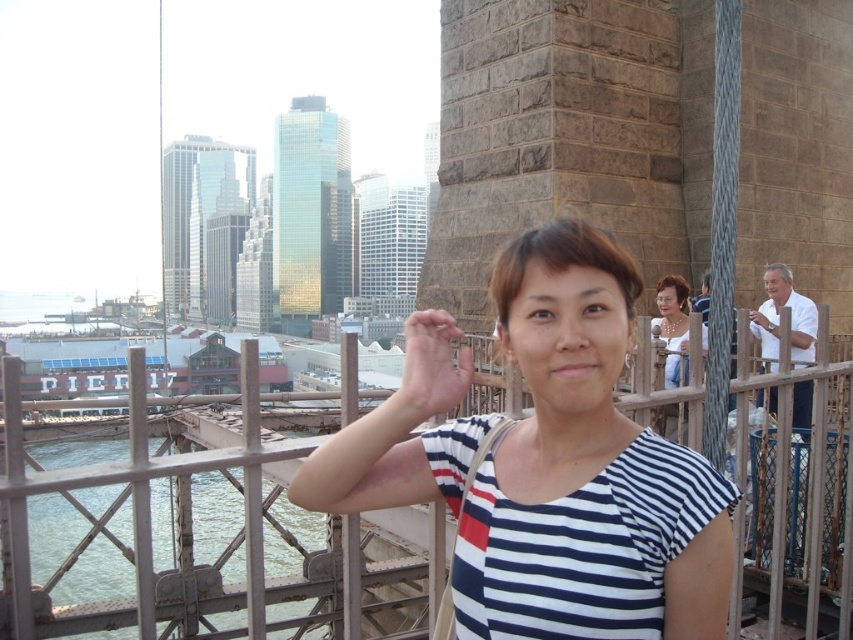
Question: Does white striped shirt at center come behind matte gold necklace at upper right?

Choices:
 (A) yes
 (B) no

Answer: (B)

Question: Does metal fence at center appear under white cotton shirt at right?

Choices:
 (A) no
 (B) yes

Answer: (B)

Question: Which point is closer to the camera taking this photo?

Choices:
 (A) (683, 330)
 (B) (426, 390)

Answer: (B)

Question: Can you confirm if white striped shirt at center is smaller than matte skin hand at center?

Choices:
 (A) no
 (B) yes

Answer: (A)

Question: Which of the following is the closest to the observer?

Choices:
 (A) white striped shirt at center
 (B) white cotton shirt at right
 (C) matte gold necklace at upper right
 (D) metal fence at center

Answer: (A)

Question: Which point is farther to the camera?

Choices:
 (A) (433, 388)
 (B) (508, 390)
 (C) (338, 477)

Answer: (B)